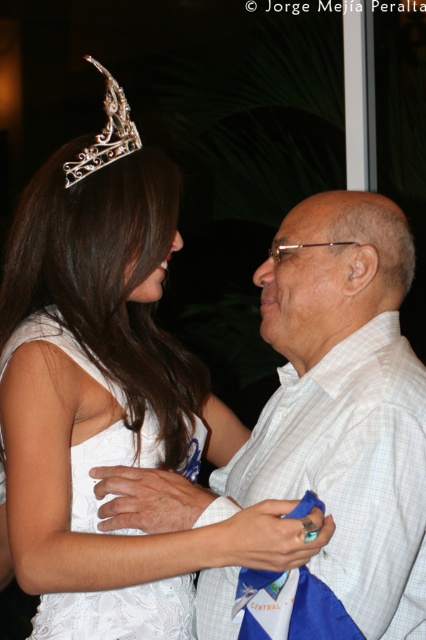
The height and width of the screenshot is (640, 426). Identify the location of white checkered shirt at center. click(x=327, y=420).

Where is `white checkered shirt at center`? The image size is (426, 640). white checkered shirt at center is located at coordinates (327, 420).

Measure the distance between white checkered shirt at center and camera.

white checkered shirt at center and camera are 1.06 meters apart.

Is the position of white checkered shirt at center less distant than that of white lace dress at center?

Yes, it is.

Image resolution: width=426 pixels, height=640 pixels. I want to click on white checkered shirt at center, so click(327, 420).

Can you confirm if white lace dress at center is positioned above silver metallic tiara at upper left?

Incorrect, white lace dress at center is not positioned above silver metallic tiara at upper left.

Can you confirm if white lace dress at center is shorter than silver metallic tiara at upper left?

In fact, white lace dress at center may be taller than silver metallic tiara at upper left.

Find the location of `white lace dress at center`. white lace dress at center is located at coordinates (120, 612).